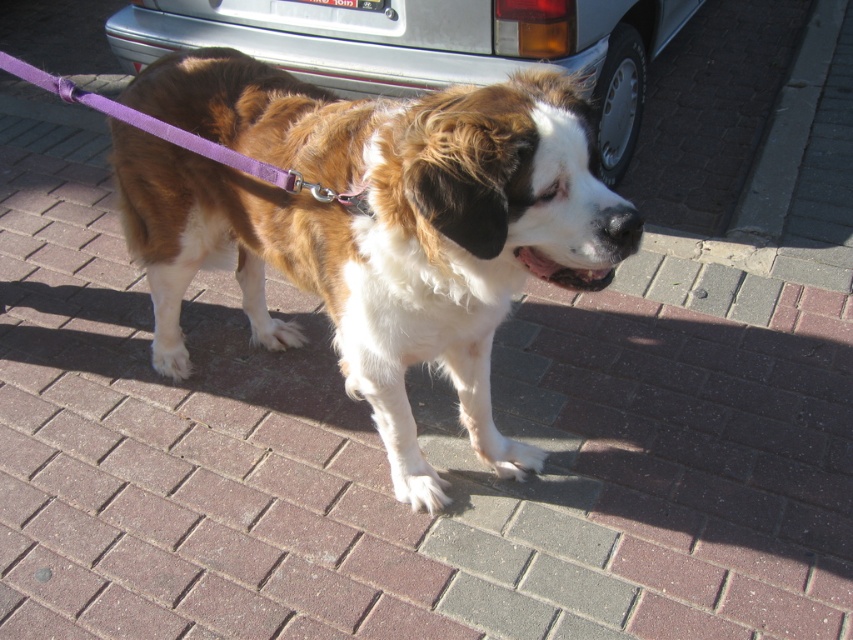
Is brown/white fur dog at center wider than purple fabric leash at center?

Yes, brown/white fur dog at center is wider than purple fabric leash at center.

Can you confirm if brown/white fur dog at center is shorter than purple fabric leash at center?

Incorrect, brown/white fur dog at center's height does not fall short of purple fabric leash at center's.

The height and width of the screenshot is (640, 853). I want to click on brown/white fur dog at center, so click(372, 225).

Does brown/white fur dog at center appear on the left side of white glossy car at upper center?

Correct, you'll find brown/white fur dog at center to the left of white glossy car at upper center.

Is point (375, 285) closer to camera compared to point (125, 10)?

Yes, it is.

Where is `brown/white fur dog at center`? Image resolution: width=853 pixels, height=640 pixels. brown/white fur dog at center is located at coordinates click(372, 225).

Is point (526, 38) farther from camera compared to point (312, 182)?

Yes, point (526, 38) is farther from viewer.

Identify the location of white glossy car at upper center. The image size is (853, 640). (426, 44).